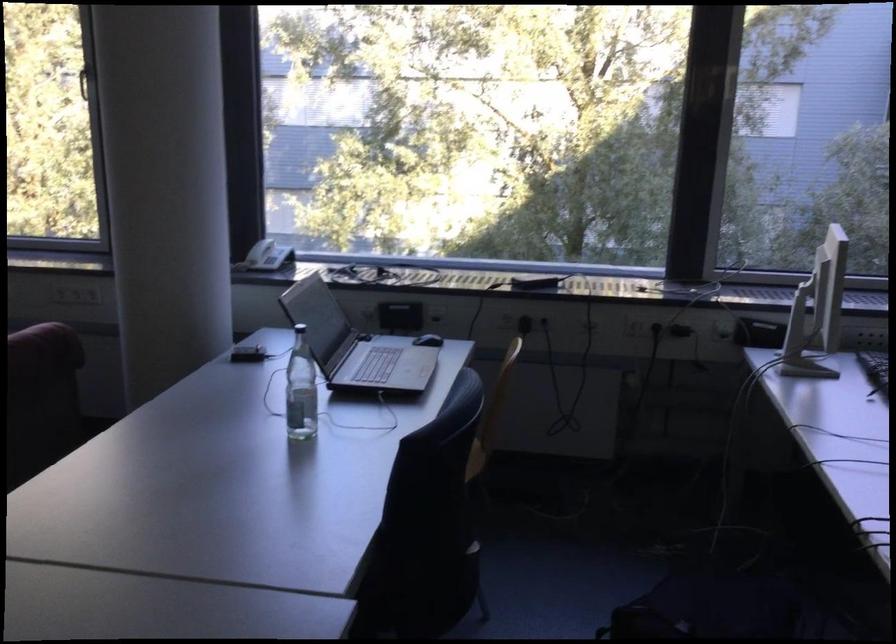
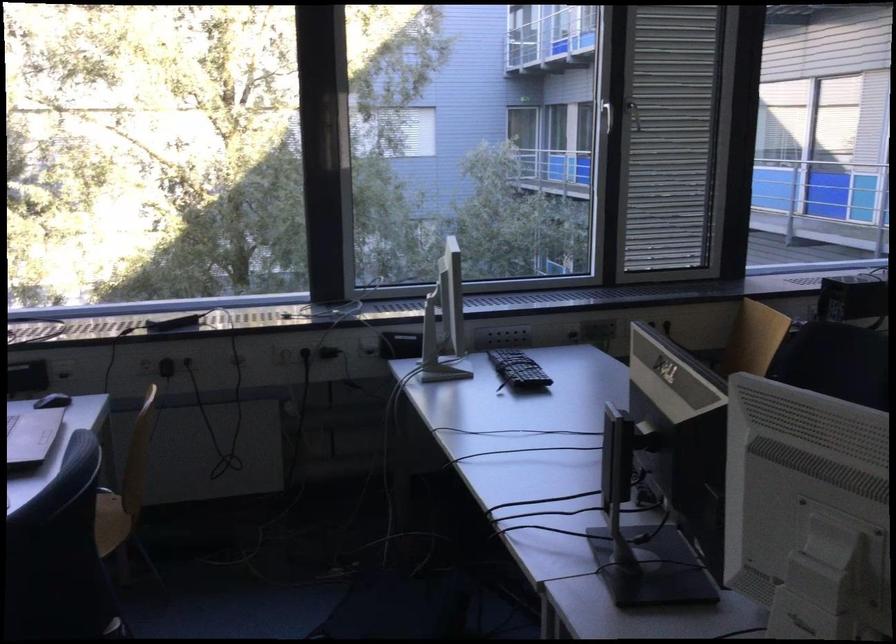
Question: What movement of the cameraman would produce the second image?

Choices:
 (A) Left
 (B) Right
 (C) Forward
 (D) Backward

Answer: (B)